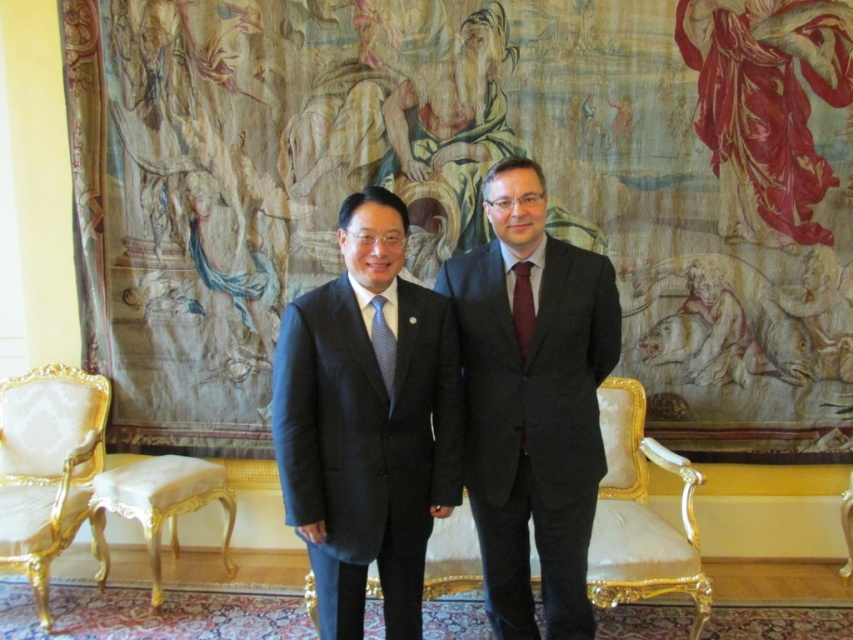
Question: Can you confirm if silky fabric tapestry at center is wider than dark gray wool suit at center?

Choices:
 (A) yes
 (B) no

Answer: (A)

Question: Does velvet gold armchair at lower left appear under blue dotted tie at center?

Choices:
 (A) yes
 (B) no

Answer: (A)

Question: Which of the following is the farthest from the observer?

Choices:
 (A) velvet gold armchair at lower left
 (B) dark gray wool suit at center

Answer: (A)

Question: Which object is positioned farthest from the dark blue wool suit at center?

Choices:
 (A) velvet gold armchair at lower left
 (B) blue dotted tie at center
 (C) dark gray wool suit at center
 (D) matte black suit at center

Answer: (A)

Question: Which of the following is the closest to the observer?

Choices:
 (A) (33, 515)
 (B) (532, 627)

Answer: (B)

Question: From the image, what is the correct spatial relationship of dark gray wool suit at center in relation to maroon satin tie at center?

Choices:
 (A) below
 (B) above

Answer: (A)